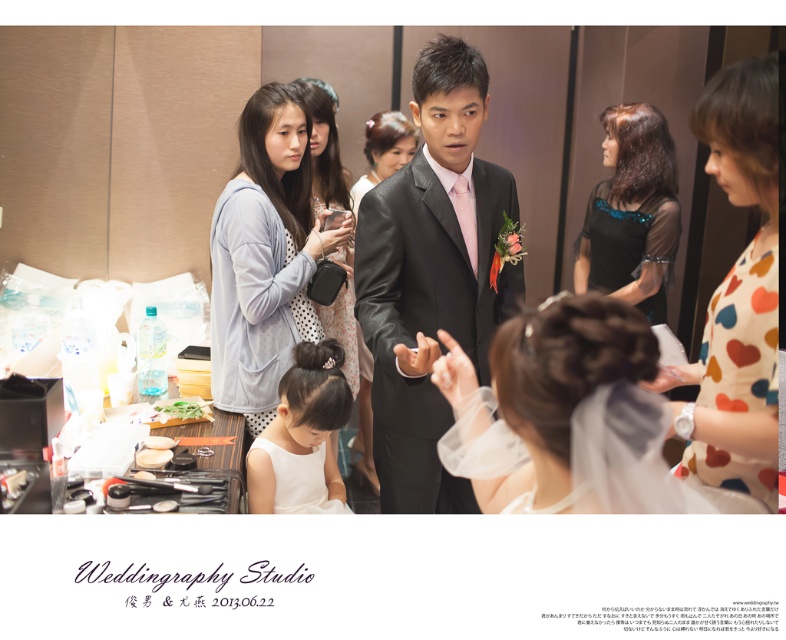
Can you confirm if shiny black suit at center is wider than light gray polka dot dress at center?

Indeed, shiny black suit at center has a greater width compared to light gray polka dot dress at center.

Is shiny black suit at center closer to camera compared to light gray polka dot dress at center?

Yes, it is in front of light gray polka dot dress at center.

Is point (443, 176) less distant than point (355, 356)?

Yes, it is.

Identify the location of shiny black suit at center. The height and width of the screenshot is (640, 786). (432, 276).

Is light blue fabric at center positioned in front of satin black dress at center?

That is True.

Is point (261, 326) closer to viewer compared to point (369, 154)?

Yes, it is.

Locate an element on the screen. light blue fabric at center is located at coordinates (265, 253).

Who is shorter, shiny black suit at center or light blue fabric at center?

Standing shorter between the two is light blue fabric at center.

Which is behind, point (443, 417) or point (254, 333)?

The point (254, 333) is behind.

Is point (480, 115) positioned after point (270, 209)?

That is False.

This screenshot has width=786, height=640. I want to click on shiny black suit at center, so click(x=432, y=276).